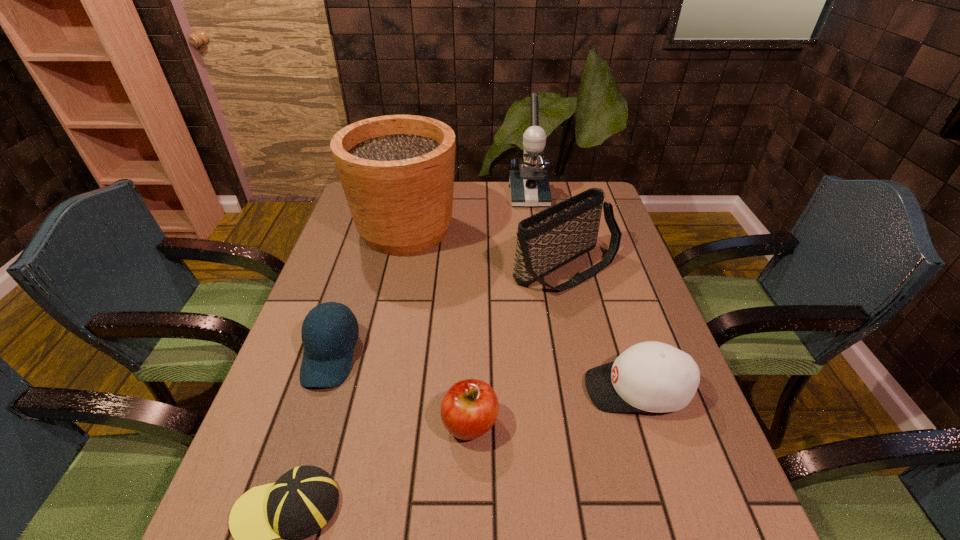
What are the coordinates of `vacant space at the left edge of the desktop` in the screenshot? It's located at (339, 237).

The image size is (960, 540). I want to click on vacant space at the right edge, so click(x=600, y=303).

Locate an element on the screen. The width and height of the screenshot is (960, 540). vacant region at the far right corner is located at coordinates (568, 193).

Locate an element on the screen. This screenshot has height=540, width=960. free space between the microscope and the flowerpot is located at coordinates (467, 212).

Locate an element on the screen. This screenshot has height=540, width=960. vacant area between the flowerpot and the handbag is located at coordinates (486, 248).

Locate an element on the screen. The height and width of the screenshot is (540, 960). free point between the fifth shortest object and the flowerpot is located at coordinates (486, 248).

Locate an element on the screen. The height and width of the screenshot is (540, 960). unoccupied position between the apple and the flowerpot is located at coordinates coord(438,327).

Identify the location of object that stands as the fifth closest to the microscope. tap(470, 407).

The image size is (960, 540). What are the coordinates of `object that stands as the fifth closest to the flowerpot` in the screenshot? It's located at (651, 376).

Select which baseball cap is the closest to the rightmost baseball cap. Please provide its 2D coordinates. Your answer should be formatted as a tuple, i.e. [(x, y)], where the tuple contains the x and y coordinates of a point satisfying the conditions above.

[(302, 501)]